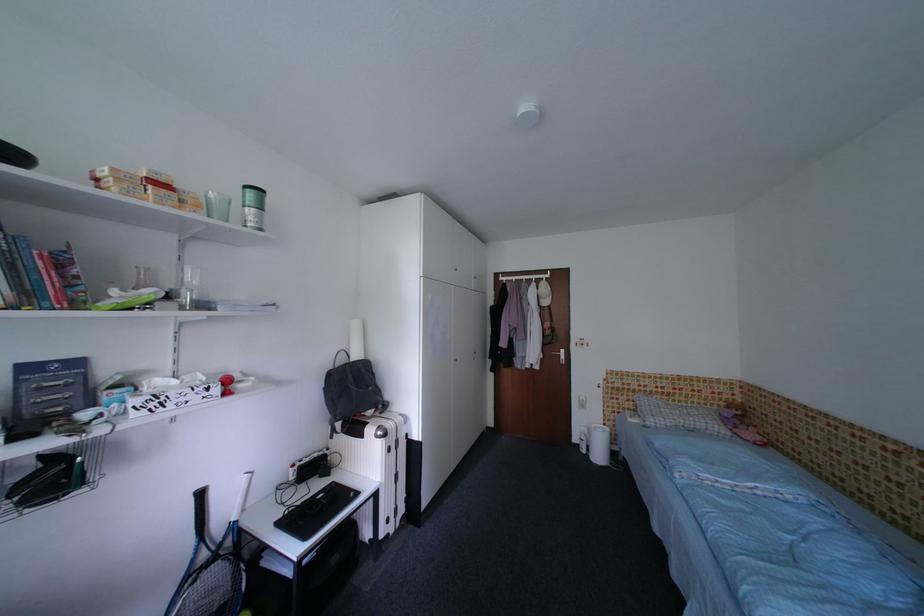
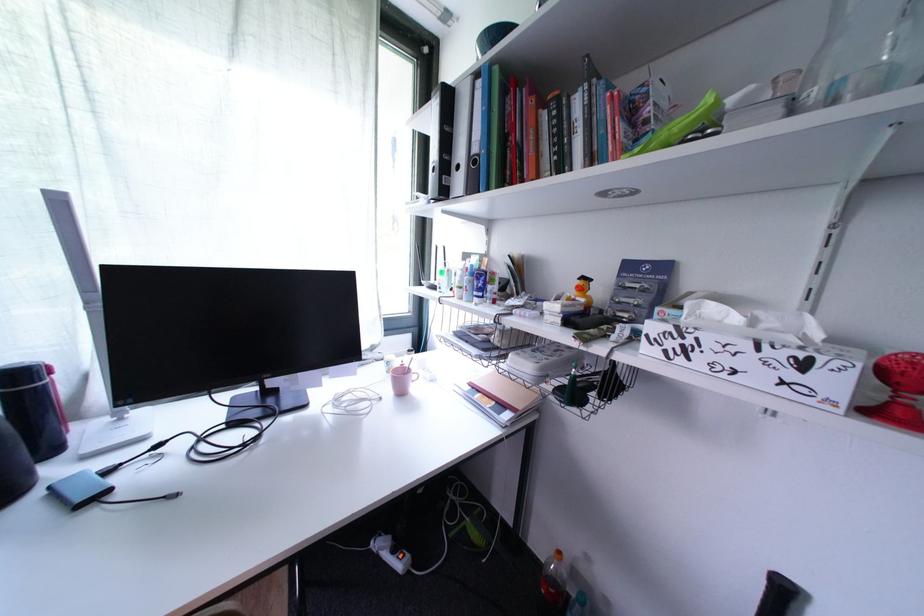
In the second image, find the point that corresponds to point (184, 385) in the first image.

(745, 321)